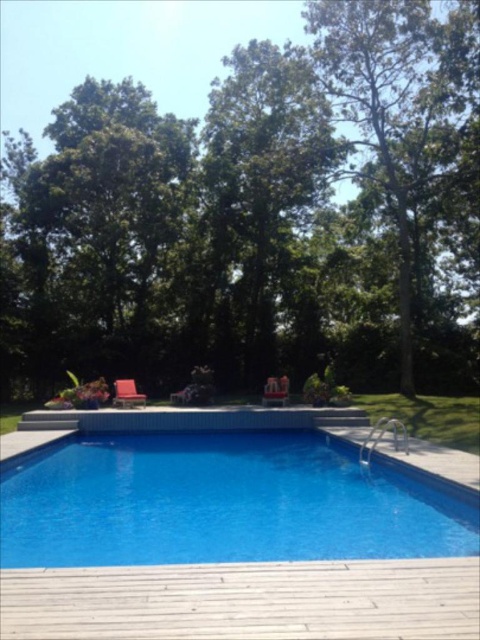
Question: Can you confirm if matte red chair at center is smaller than metallic silver chair at center?

Choices:
 (A) yes
 (B) no

Answer: (B)

Question: Is green leafy tree at upper center below metallic red chair at center?

Choices:
 (A) no
 (B) yes

Answer: (A)

Question: Does blue tile swimming pool at center appear on the right side of matte red chair at center?

Choices:
 (A) yes
 (B) no

Answer: (A)

Question: Among these points, which one is farthest from the camera?

Choices:
 (A) click(x=127, y=378)
 (B) click(x=264, y=387)
 (C) click(x=360, y=589)
 (D) click(x=137, y=554)

Answer: (A)

Question: Which point is closer to the camera?

Choices:
 (A) (134, 400)
 (B) (474, 605)

Answer: (B)

Question: Among these objects, which one is farthest from the camera?

Choices:
 (A) matte red chair at center
 (B) blue tile swimming pool at center
 (C) metallic silver chair at center
 (D) wooden deck at lower center

Answer: (C)